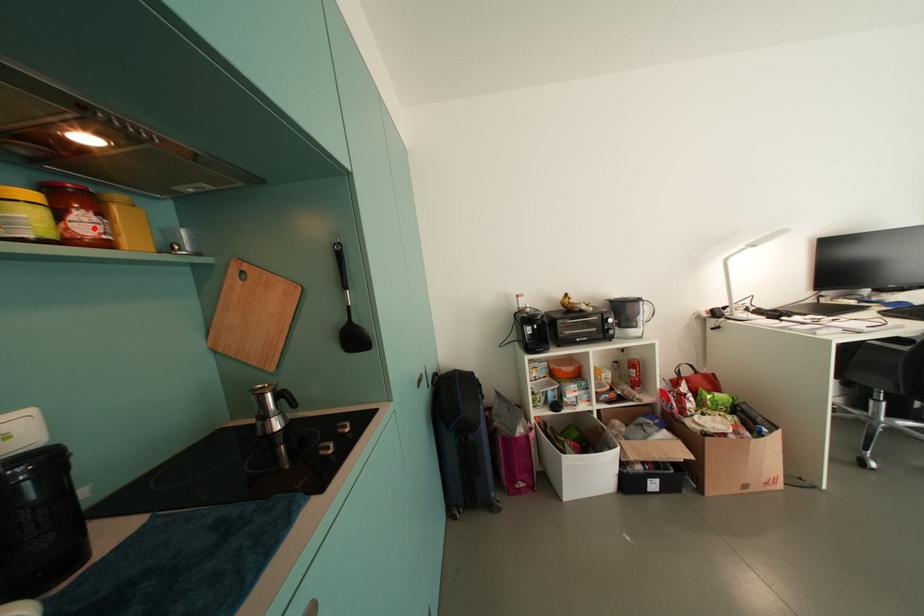
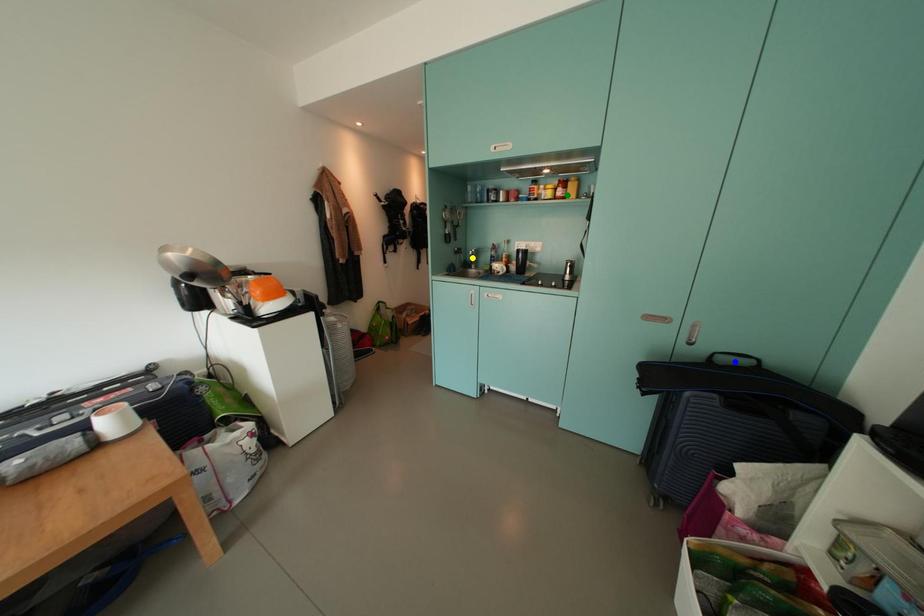
Question: I am providing you with two images of the same scene from different viewpoints. A red point is marked on the first image. You are given multiple points on the second image. In image 2, which mark is for the same physical point as the one in image 1?

Choices:
 (A) blue point
 (B) green point
 (C) yellow point

Answer: (B)